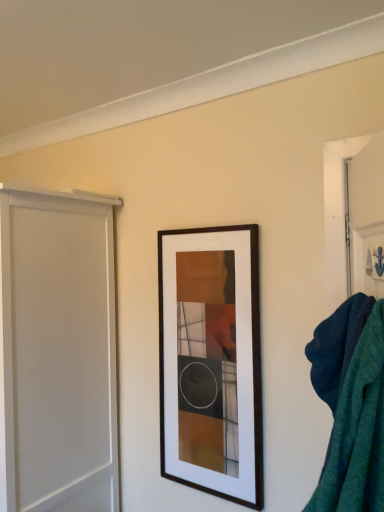
Question: In terms of height, does wooden picture frame at center look taller or shorter compared to teal fabric bath towel at right?

Choices:
 (A) short
 (B) tall

Answer: (B)

Question: Based on their sizes in the image, would you say wooden picture frame at center is bigger or smaller than teal fabric bath towel at right?

Choices:
 (A) big
 (B) small

Answer: (A)

Question: Which of these objects is positioned farthest from the white matte screen door at left?

Choices:
 (A) wooden picture frame at center
 (B) teal fabric bath towel at right

Answer: (B)

Question: Which object is the closest to the white matte screen door at left?

Choices:
 (A) teal fabric bath towel at right
 (B) wooden picture frame at center

Answer: (B)